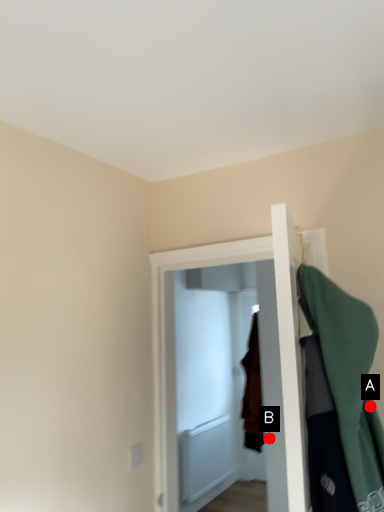
Question: Two points are circled on the image, labeled by A and B beside each circle. Among these points, which one is farthest from the camera?

Choices:
 (A) A is further
 (B) B is further

Answer: (B)